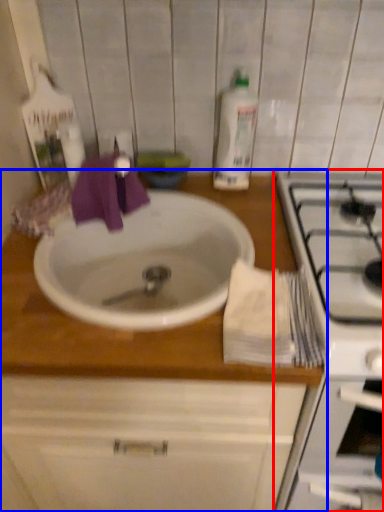
Question: Among these objects, which one is nearest to the camera, appliance (highlighted by a red box) or countertop (highlighted by a blue box)?

Choices:
 (A) appliance
 (B) countertop

Answer: (A)